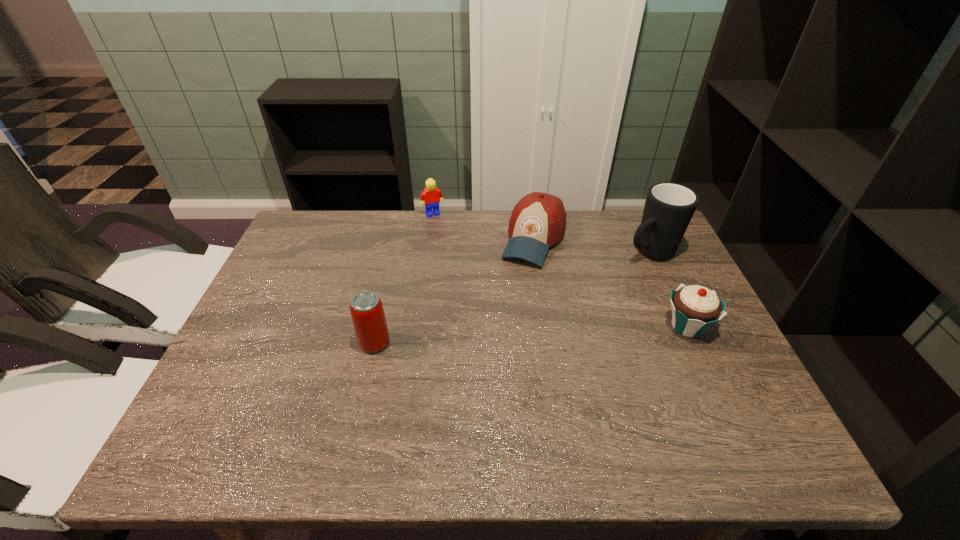
Locate an element on the screen. free space between the Lego and the baseball cap is located at coordinates (483, 226).

Where is `unoccupied position between the beer can and the Lego`? unoccupied position between the beer can and the Lego is located at coordinates (404, 279).

The width and height of the screenshot is (960, 540). In order to click on free spot between the leftmost object and the cupcake in this screenshot , I will do `click(531, 335)`.

At what (x,y) coordinates should I click in order to perform the action: click on free space between the cupcake and the third object from left to right. Please return your answer as a coordinate pair (x, y). This screenshot has width=960, height=540. Looking at the image, I should click on (611, 282).

Locate an element on the screen. This screenshot has width=960, height=540. free spot between the Lego and the cupcake is located at coordinates (560, 270).

You are a GUI agent. You are given a task and a screenshot of the screen. Output one action in this format:
    pyautogui.click(x=<x>, y=<y>)
    Task: Click on the free space between the third object from left to right and the tallest object
    This screenshot has width=960, height=540.
    Given the screenshot: What is the action you would take?
    pyautogui.click(x=591, y=245)

Locate an element on the screen. Image resolution: width=960 pixels, height=540 pixels. free space between the tallest object and the beer can is located at coordinates (512, 298).

Where is `object that is the second closest to the Lego`? This screenshot has width=960, height=540. object that is the second closest to the Lego is located at coordinates (366, 308).

In order to click on object that is the fourth closest one to the cupcake in this screenshot , I will do coord(432,196).

The image size is (960, 540). I want to click on vacant area that satisfies the following two spatial constraints: 1. on the back side of the third object from left to right; 2. on the right side of the leftmost object, so click(x=398, y=239).